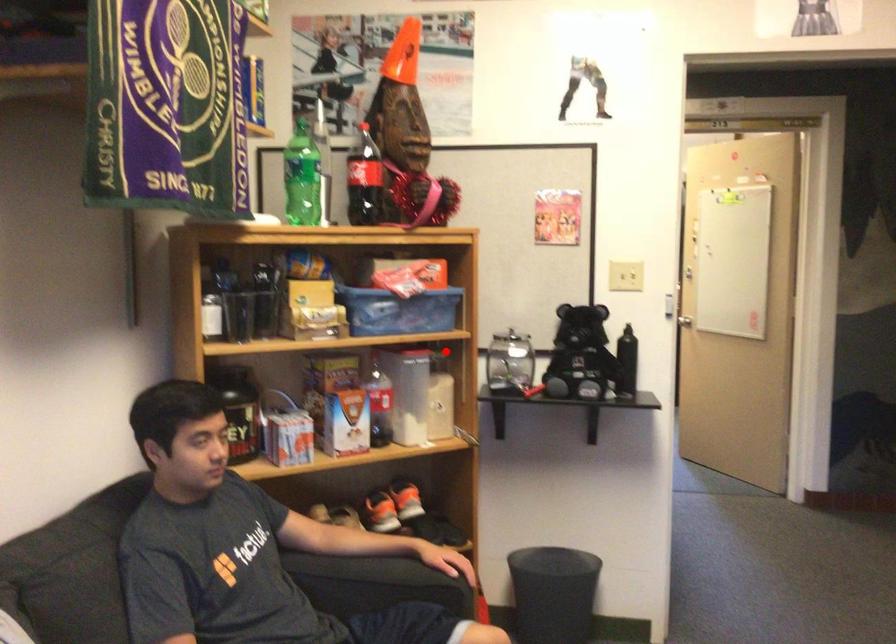
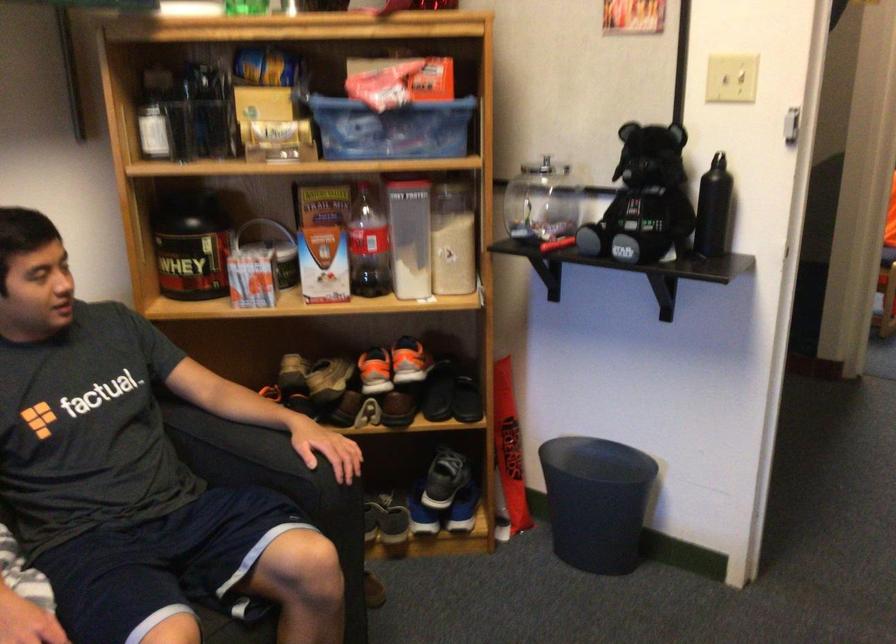
Question: I am providing you with two images of the same scene from different viewpoints. In image1, a red point is highlighted. Considering the same 3D point in image2, which of the following is correct?

Choices:
 (A) It is closer
 (B) It is farther

Answer: (A)